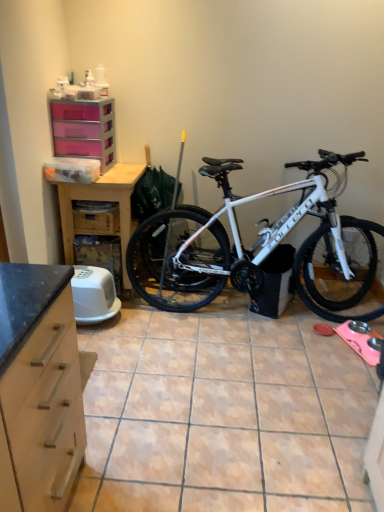
Question: Is pink plastic drawers at upper left turned away from white matte bicycle at center?

Choices:
 (A) no
 (B) yes

Answer: (A)

Question: From the image's perspective, would you say pink plastic drawers at upper left is positioned over white matte bicycle at center?

Choices:
 (A) no
 (B) yes

Answer: (B)

Question: Are pink plastic drawers at upper left and white matte bicycle at center far apart?

Choices:
 (A) yes
 (B) no

Answer: (A)

Question: Is pink plastic drawers at upper left beside white matte bicycle at center?

Choices:
 (A) yes
 (B) no

Answer: (B)

Question: Is pink plastic drawers at upper left bigger than white matte bicycle at center?

Choices:
 (A) no
 (B) yes

Answer: (A)

Question: Is pink plastic drawers at upper left not within white matte bicycle at center?

Choices:
 (A) yes
 (B) no

Answer: (A)

Question: From the image's perspective, is porcelain tile at center on white matte bicycle at center?

Choices:
 (A) no
 (B) yes

Answer: (A)

Question: Considering the relative positions of porcelain tile at center and white matte bicycle at center in the image provided, is porcelain tile at center to the left of white matte bicycle at center from the viewer's perspective?

Choices:
 (A) yes
 (B) no

Answer: (A)

Question: Is porcelain tile at center in front of white matte bicycle at center?

Choices:
 (A) yes
 (B) no

Answer: (A)

Question: Does porcelain tile at center have a lesser width compared to white matte bicycle at center?

Choices:
 (A) no
 (B) yes

Answer: (A)

Question: Considering the relative sizes of porcelain tile at center and white matte bicycle at center in the image provided, is porcelain tile at center wider than white matte bicycle at center?

Choices:
 (A) yes
 (B) no

Answer: (A)

Question: Is porcelain tile at center at the right side of white matte bicycle at center?

Choices:
 (A) no
 (B) yes

Answer: (A)

Question: From a real-world perspective, is white matte bicycle at center beneath porcelain tile at center?

Choices:
 (A) yes
 (B) no

Answer: (B)